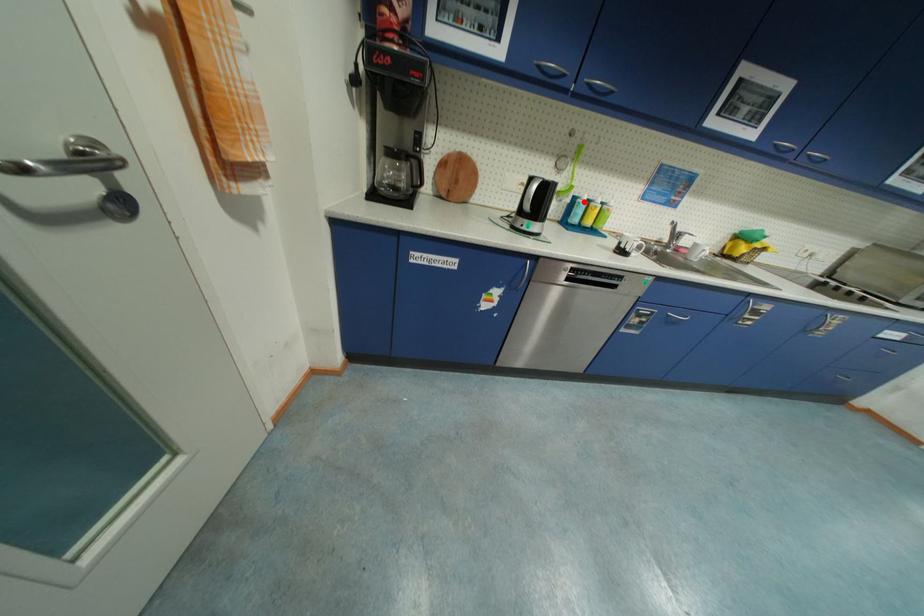
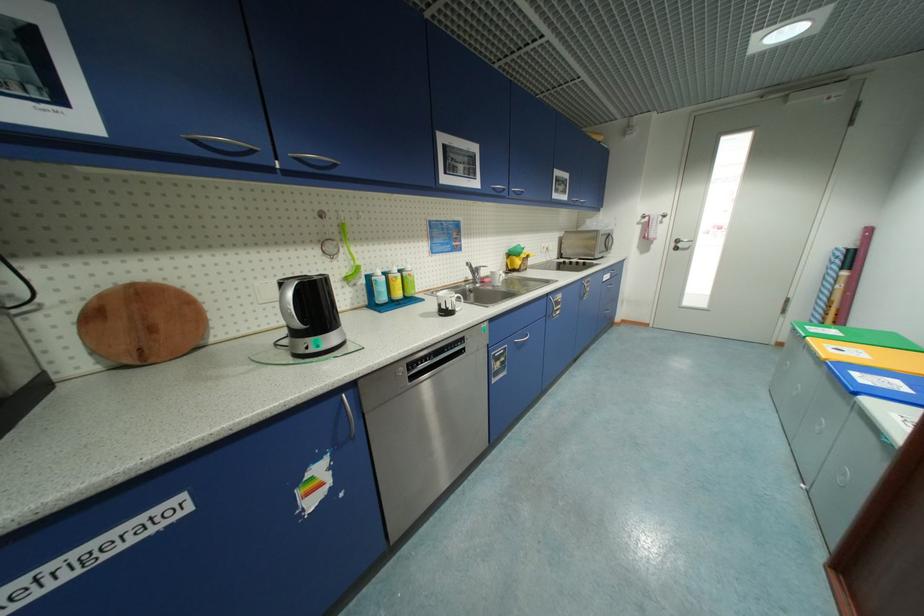
In the second image, find the point that corresponds to the highlighted location in the first image.

(380, 280)